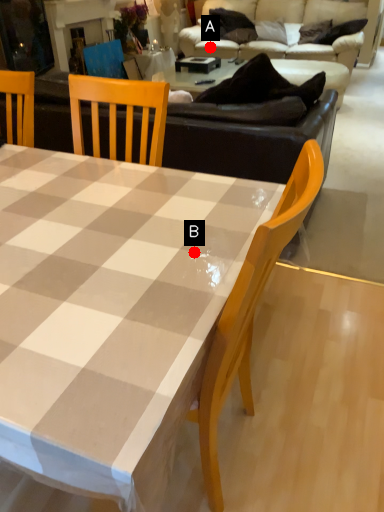
Question: Two points are circled on the image, labeled by A and B beside each circle. Which of the following is the closest to the observer?

Choices:
 (A) A is closer
 (B) B is closer

Answer: (B)